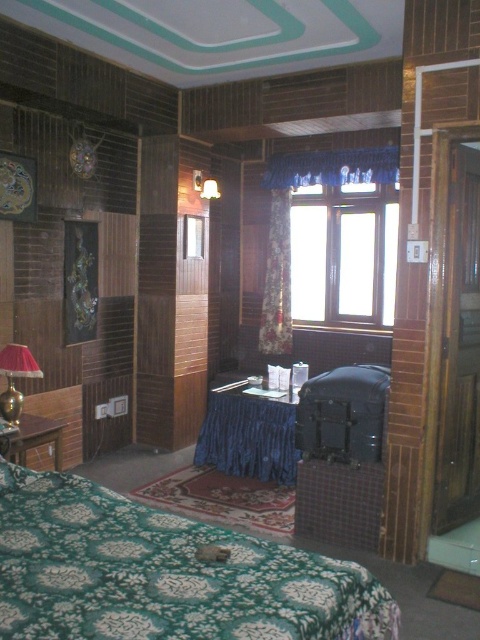
You are arranging a themed party and need to decide which curtain to use for the main entrance. The blue fabric curtain at upper center and the floral fabric curtain at center are options. Which curtain has a greater width?

The blue fabric curtain at upper center has a greater width than the floral fabric curtain at center according to the description.

You are standing in the room and want to look outside through the clear glass window at center. Based on its position, where should you look to see the window?

The clear glass window at center is located at coordinates point (344, 253), so you should look towards that point to see the window.